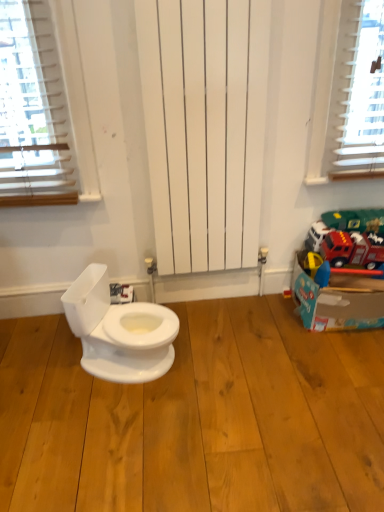
The width and height of the screenshot is (384, 512). Identify the location of blank space situated above light brown wood flooring at center (from a real-world perspective). (173, 378).